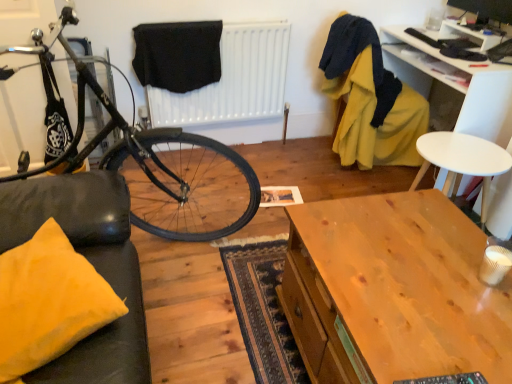
The width and height of the screenshot is (512, 384). I want to click on free point above black fabric at upper center (from a real-world perspective), so click(209, 15).